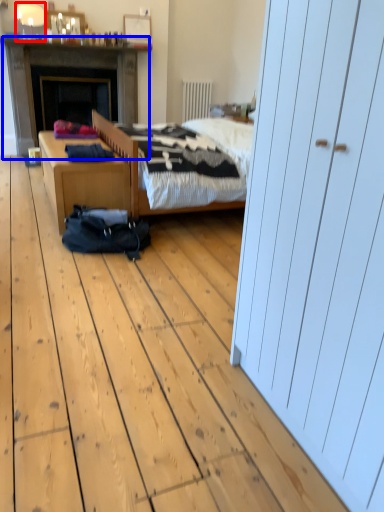
Question: Which point is closer to the camera, lamp (highlighted by a red box) or fireplace (highlighted by a blue box)?

Choices:
 (A) lamp
 (B) fireplace

Answer: (A)